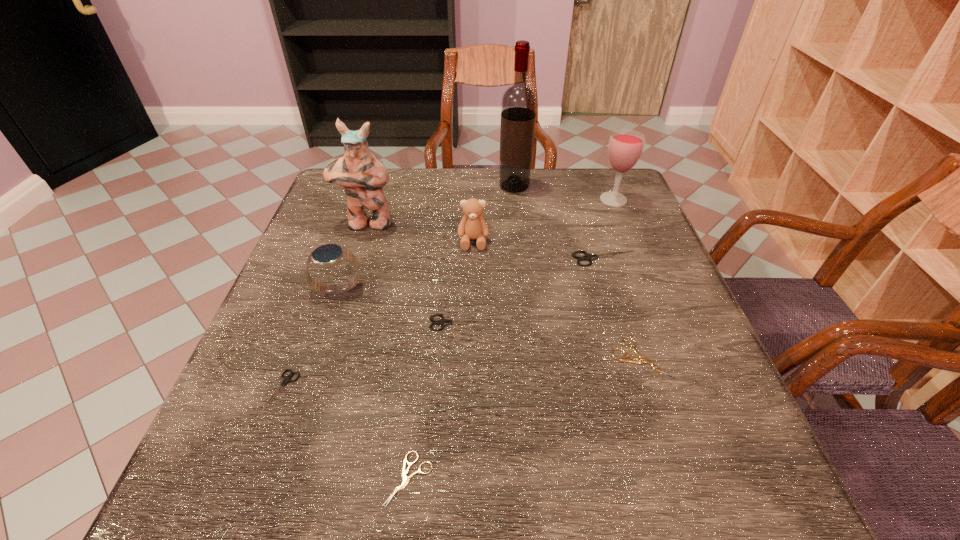
The height and width of the screenshot is (540, 960). I want to click on vacant space situated 0.120m on the back of the eighth shortest object, so click(602, 170).

Find the location of `vacant space located 0.220m on the front-facing side of the teddy bear`. vacant space located 0.220m on the front-facing side of the teddy bear is located at coordinates (472, 320).

At what (x,y) coordinates should I click in order to perform the action: click on vacant space located 0.280m on the back of the blue watch. Please return your answer as a coordinate pair (x, y). Looking at the image, I should click on (365, 208).

Locate an element on the screen. vacant space located on the left of the biggest black shears is located at coordinates (522, 259).

Locate an element on the screen. vacant region located on the right of the seventh tallest object is located at coordinates (637, 323).

Find the location of a particular element. Image resolution: width=960 pixels, height=540 pixels. vacant area located 0.360m on the left of the right beige shears is located at coordinates (421, 359).

I want to click on free space located 0.310m on the back of the smallest black shears, so click(330, 260).

Where is `free spot located 0.160m on the back of the smaller beige shears`? Image resolution: width=960 pixels, height=540 pixels. free spot located 0.160m on the back of the smaller beige shears is located at coordinates (421, 368).

Identify the location of wine bottle present at the far edge. (519, 102).

This screenshot has width=960, height=540. Identify the location of wineglass present at the far edge. (625, 147).